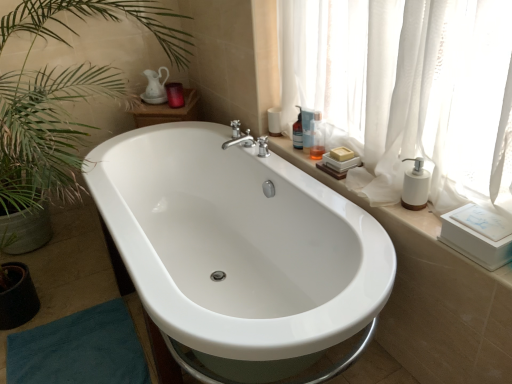
You are a GUI agent. You are given a task and a screenshot of the screen. Output one action in this format:
    pyautogui.click(x=<x>, y=<y>)
    Task: Click on the vacant space in front of white matte soap dispenser at right
    Image resolution: width=512 pixels, height=384 pixels.
    Given the screenshot: What is the action you would take?
    pyautogui.click(x=417, y=225)